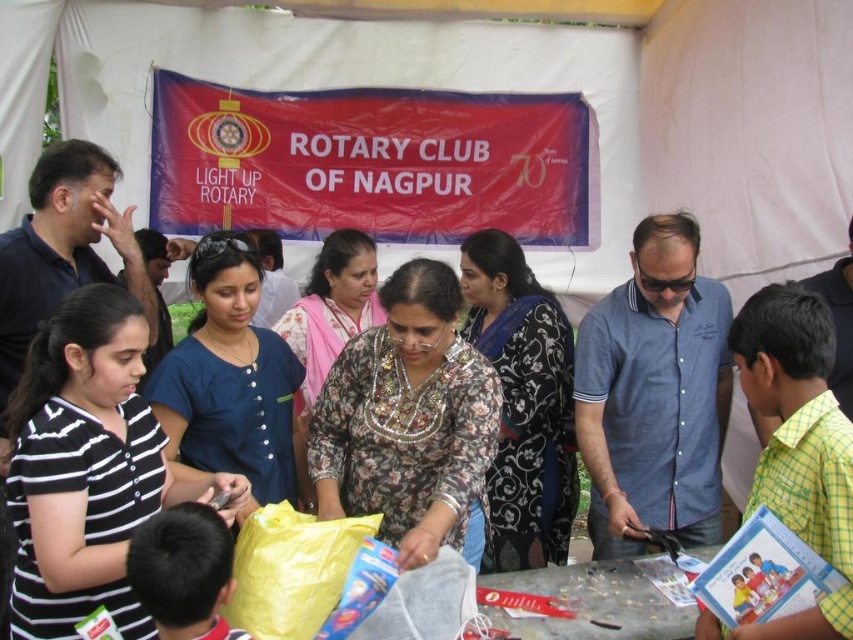
Between floral printed dress at center and yellow checkered shirt at center, which one has less height?

yellow checkered shirt at center is shorter.

Is floral printed dress at center below yellow checkered shirt at center?

No.

Between point (422, 476) and point (766, 492), which one is positioned behind?

Point (422, 476)

Locate an element on the screen. This screenshot has height=640, width=853. floral printed dress at center is located at coordinates click(408, 420).

Is point (782, 632) behind point (247, 396)?

No, (782, 632) is closer to viewer.

Based on the photo, is yellow checkered shirt at center smaller than blue fabric shirt at center?

Yes.

Measure the distance between point [761,342] and camera.

The distance of point [761,342] from camera is 6.82 feet.

Identify the location of yellow checkered shirt at center. (796, 449).

Does point (425, 400) lie in front of point (490, 276)?

Yes, point (425, 400) is in front of point (490, 276).

Is floral printed dress at center thinner than black floral dress at center?

No.

The image size is (853, 640). What do you see at coordinates (408, 420) in the screenshot?
I see `floral printed dress at center` at bounding box center [408, 420].

This screenshot has height=640, width=853. In order to click on floral printed dress at center in this screenshot , I will do `click(408, 420)`.